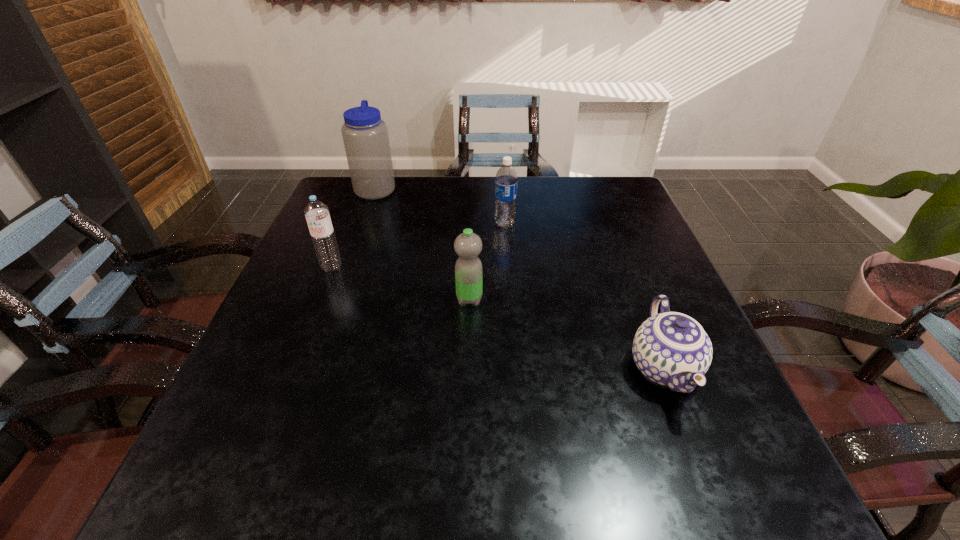
In order to click on blank space located 0.250m on the right of the rightmost water bottle in this screenshot , I will do coord(611,224).

The height and width of the screenshot is (540, 960). I want to click on free space located on the back of the third farthest water bottle, so click(x=364, y=184).

I want to click on vacant space located on the front of the third object from right to left, so click(x=466, y=449).

The height and width of the screenshot is (540, 960). What are the coordinates of `free region located 0.130m at the spout of the nearest object` in the screenshot? It's located at (715, 503).

Find the location of a particular element. object located in the right edge section of the desktop is located at coordinates (672, 349).

Where is `object present at the far left corner`? The image size is (960, 540). object present at the far left corner is located at coordinates (365, 136).

This screenshot has width=960, height=540. I want to click on vacant space at the far edge of the desktop, so click(537, 190).

Image resolution: width=960 pixels, height=540 pixels. Find the location of `free region at the near edge`. free region at the near edge is located at coordinates (556, 478).

Find the location of `free space at the left edge of the desktop`. free space at the left edge of the desktop is located at coordinates (324, 380).

Identify the location of vacant space at the right edge of the desktop. The width and height of the screenshot is (960, 540). (658, 264).